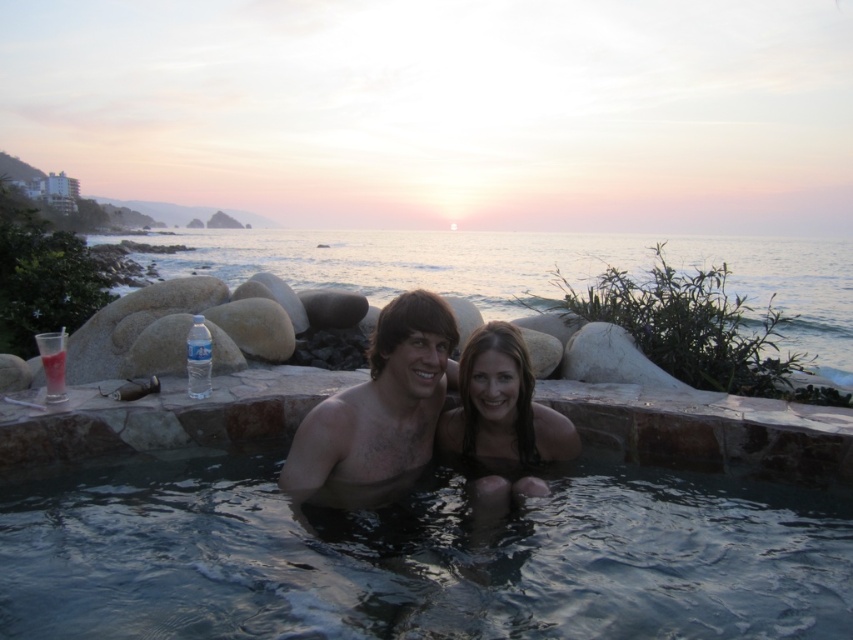
Question: Is clear glass pool at center behind clear water at center?

Choices:
 (A) yes
 (B) no

Answer: (B)

Question: Which point is closer to the camera?

Choices:
 (A) shiny brown hair at center
 (B) clear water at center

Answer: (A)

Question: In this image, where is clear water at center located relative to shiny brown hair at center?

Choices:
 (A) right
 (B) left

Answer: (A)

Question: Does shiny brown hair at center have a larger size compared to smooth skin girl at center?

Choices:
 (A) no
 (B) yes

Answer: (B)

Question: Estimate the real-world distances between objects in this image. Which object is closer to the shiny brown hair at center?

Choices:
 (A) smooth skin girl at center
 (B) clear water at center
 (C) clear glass pool at center

Answer: (A)

Question: Which of these objects is positioned closest to the clear glass pool at center?

Choices:
 (A) shiny brown hair at center
 (B) clear water at center
 (C) smooth skin girl at center

Answer: (A)